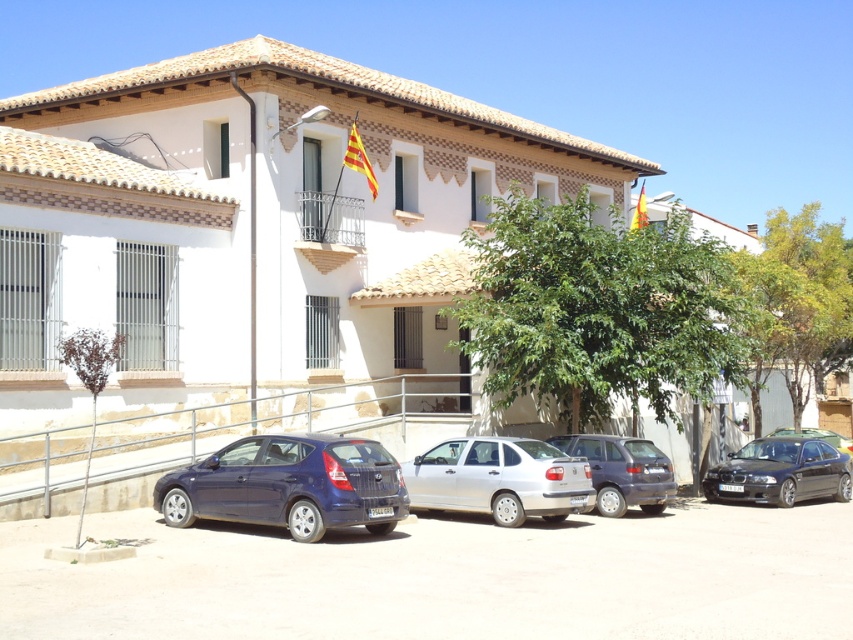
Does satin blue hatchback at lower left have a greater width compared to satin silver sedan at lower right?

Yes.

Measure the distance between satin blue hatchback at lower left and satin silver sedan at lower right.

satin blue hatchback at lower left is 21.69 meters away from satin silver sedan at lower right.

Is point (165, 483) farther from camera compared to point (784, 428)?

No.

The image size is (853, 640). What are the coordinates of `satin blue hatchback at lower left` in the screenshot? It's located at click(x=289, y=484).

Does green leafy tree at center have a greater height compared to shiny black sedan at right?

Incorrect, green leafy tree at center's height is not larger of shiny black sedan at right's.

Is point (625, 330) positioned before point (805, 451)?

Yes, point (625, 330) is in front of point (805, 451).

Who is more forward, (693, 237) or (791, 461)?

Point (791, 461) is in front.

The height and width of the screenshot is (640, 853). I want to click on green leafy tree at center, so click(596, 308).

Who is shorter, green leafy tree at right or brown textured tree at lower left?

Standing shorter between the two is brown textured tree at lower left.

Which is more to the left, green leafy tree at right or brown textured tree at lower left?

brown textured tree at lower left

Is point (781, 304) farther from camera compared to point (86, 337)?

Yes, it is.

You are a GUI agent. You are given a task and a screenshot of the screen. Output one action in this format:
    pyautogui.click(x=<x>, y=<y>)
    Task: Click on the green leafy tree at right
    The height and width of the screenshot is (640, 853).
    Given the screenshot: What is the action you would take?
    pyautogui.click(x=796, y=305)